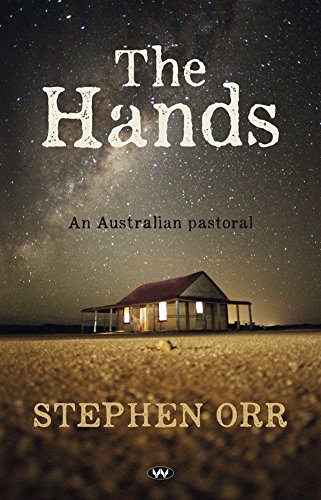
I want to click on pillars, so click(x=179, y=317), click(x=152, y=317), click(x=129, y=317), click(x=110, y=319), click(x=94, y=319).